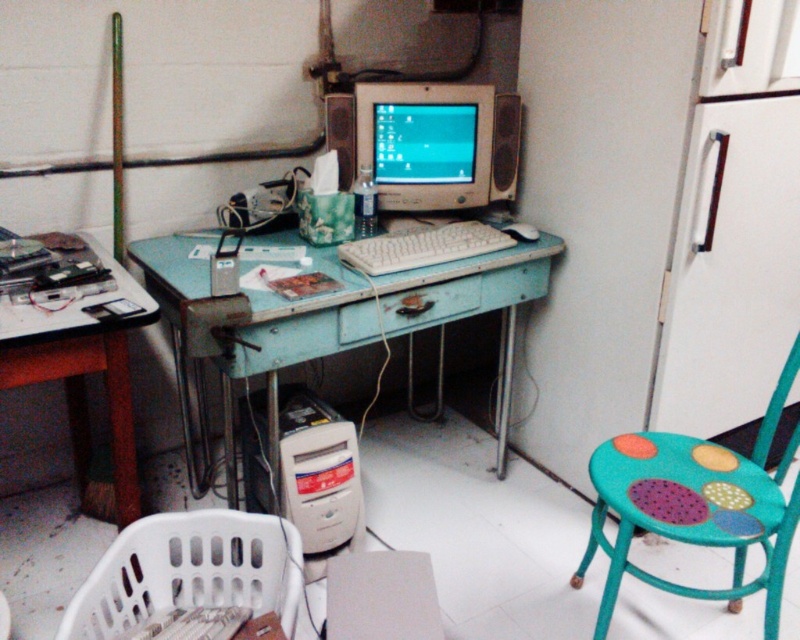
Question: Can you confirm if teal painted wood stool at right is thinner than white plastic laundry basket at lower left?

Choices:
 (A) no
 (B) yes

Answer: (A)

Question: Which point is closer to the camera taking this photo?

Choices:
 (A) (214, 593)
 (B) (678, 493)
 (C) (288, 413)

Answer: (B)

Question: Can you confirm if matte plastic monitor at center is positioned below white plastic keyboard at center?

Choices:
 (A) no
 (B) yes

Answer: (A)

Question: Can you confirm if wooden table at left is smaller than matte plastic monitor at center?

Choices:
 (A) no
 (B) yes

Answer: (A)

Question: Which is nearer to the wooden table at left?

Choices:
 (A) teal painted wood stool at right
 (B) matte plastic monitor at center

Answer: (B)

Question: Among these points, which one is nearest to the camera?

Choices:
 (A) (684, 515)
 (B) (326, 442)
 (C) (242, 321)
 (D) (0, 349)

Answer: (D)